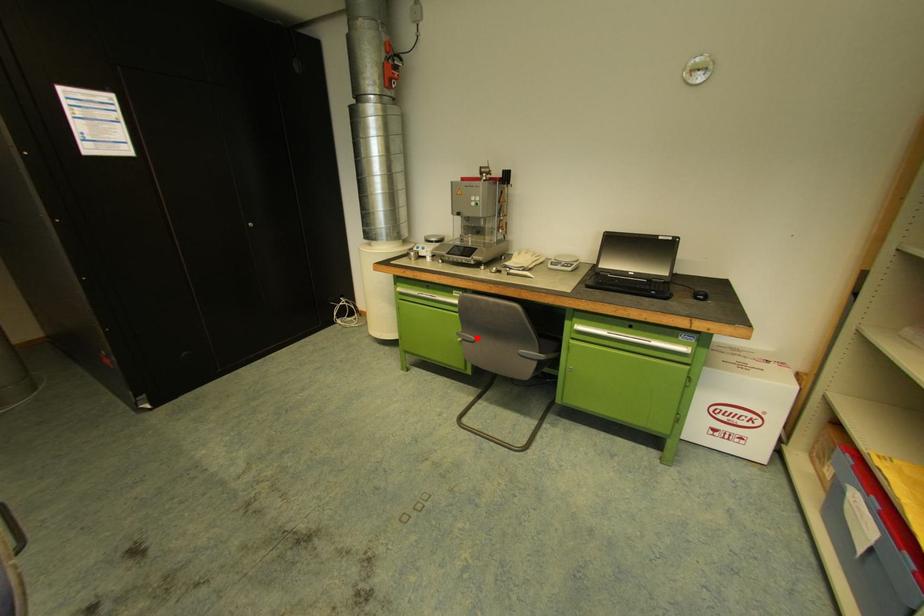
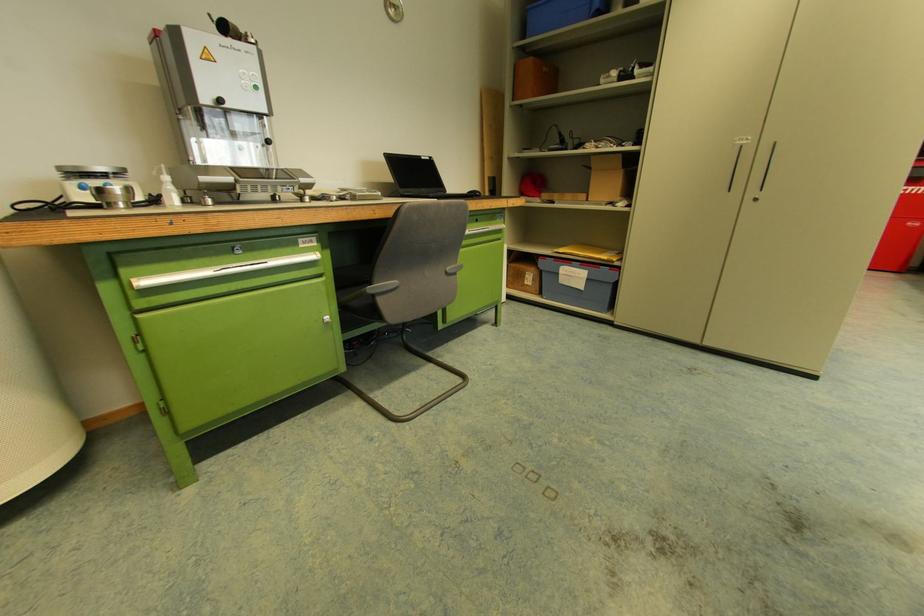
Question: I am providing you with two images of the same scene from different viewpoints. A red point is marked on the first image. Is the red point's position out of view in image 2?

Choices:
 (A) Yes
 (B) No

Answer: (B)